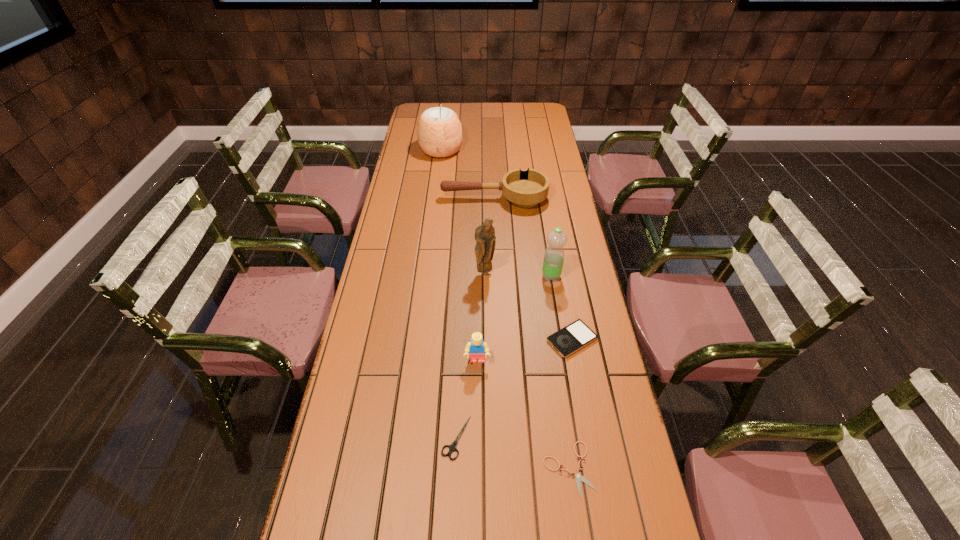
The image size is (960, 540). I want to click on coconut, so pos(439,131).

Identify the location of figurine. The height and width of the screenshot is (540, 960). (485, 238).

Locate an element on the screen. This screenshot has width=960, height=540. water bottle is located at coordinates (553, 261).

In order to click on the fifth shortest object in this screenshot , I will do `click(476, 347)`.

Locate an element on the screen. The image size is (960, 540). the second farthest object is located at coordinates (525, 189).

In order to click on saucepan in this screenshot , I will do 525,189.

Locate an element on the screen. The image size is (960, 540). the third shortest object is located at coordinates (573, 337).

The width and height of the screenshot is (960, 540). Find the location of `the left shears`. the left shears is located at coordinates (452, 448).

Where is `the second shortest object`? This screenshot has height=540, width=960. the second shortest object is located at coordinates pyautogui.click(x=452, y=448).

At what (x,y) coordinates should I click in order to perform the action: click on the shortest object. Please return your answer as a coordinate pair (x, y). Looking at the image, I should click on (578, 476).